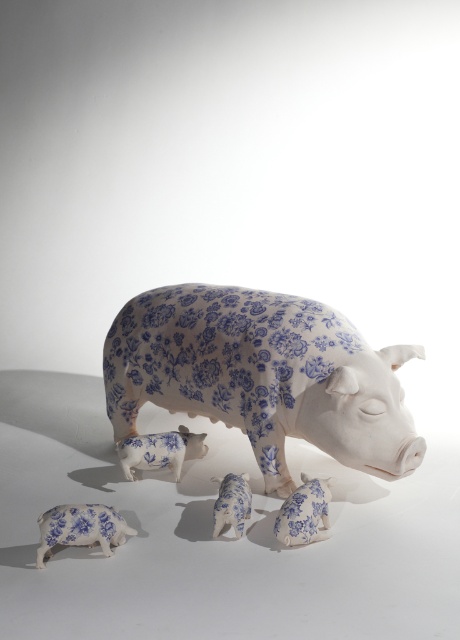
Identify the location of blue porcelain piglet at center. (160, 451).

Identify the location of blue porcelain piglet at center. (160, 451).

Find the location of a particular element. blue porcelain piglet at center is located at coordinates (160, 451).

Between point (402, 456) and point (145, 436), which one is positioned behind?

The point (145, 436) is behind.

Between blue floral-patterned pig at center and blue porcelain piglet at center, which one has more height?

blue floral-patterned pig at center is taller.

Is point (310, 358) closer to camera compared to point (172, 461)?

Yes.

Where is `blue floral-patterned pig at center`? The height and width of the screenshot is (640, 460). blue floral-patterned pig at center is located at coordinates coord(262,376).

Is point (92, 536) closer to viewer compared to point (162, 458)?

Yes, point (92, 536) is closer to viewer.

From the picture: Between blue and white porcelain piglet at lower left and blue porcelain piglet at center, which one has less height?

blue and white porcelain piglet at lower left is shorter.

Where is `blue and white porcelain piglet at lower left`? This screenshot has height=640, width=460. blue and white porcelain piglet at lower left is located at coordinates (80, 529).

The image size is (460, 640). Find the location of `blue and white porcelain piglet at lower left`. blue and white porcelain piglet at lower left is located at coordinates (80, 529).